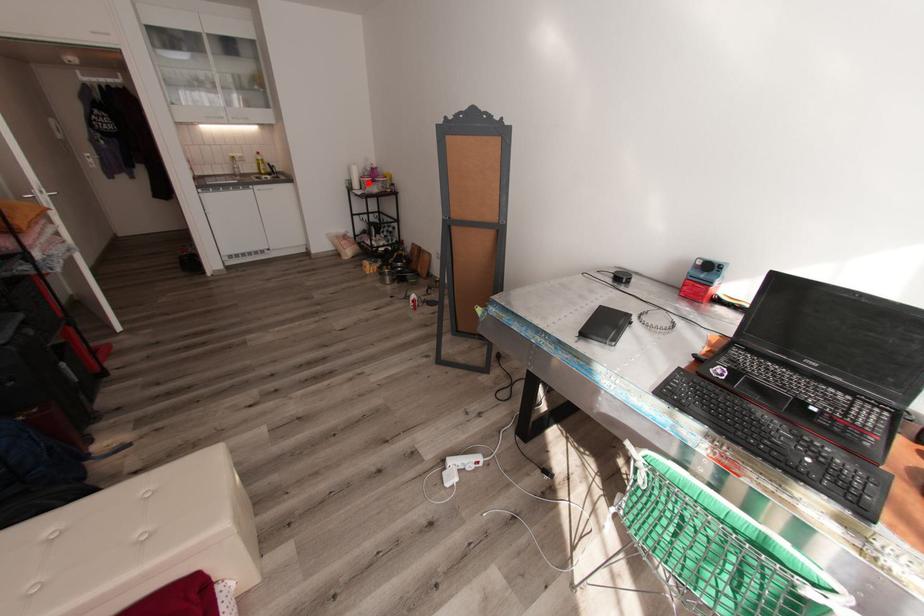
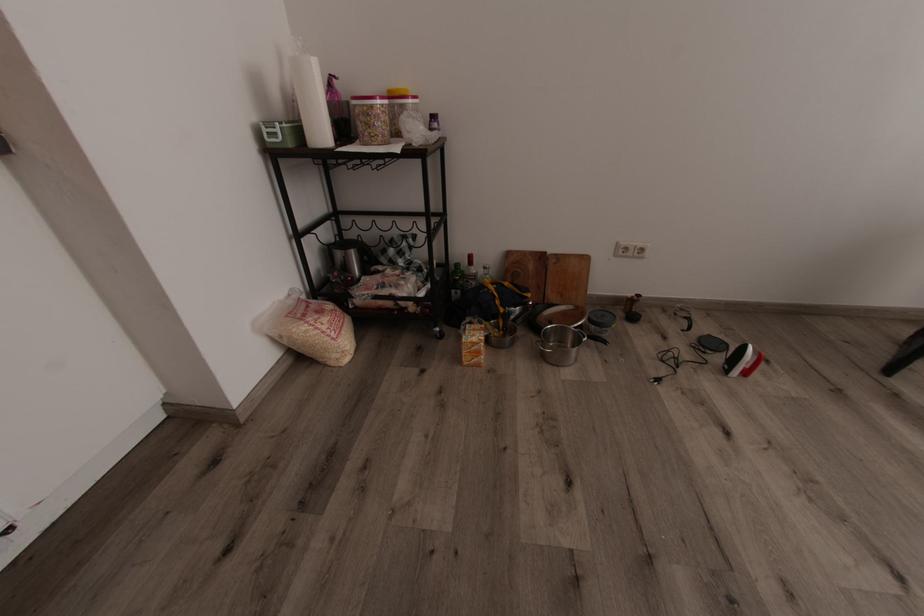
Question: I am providing you with two images of the same scene from different viewpoints. Image1 has a red point marked. In image2, the corresponding 3D location appears at what relative position? Reply with the corresponding letter.

Choices:
 (A) Closer
 (B) Farther

Answer: (B)